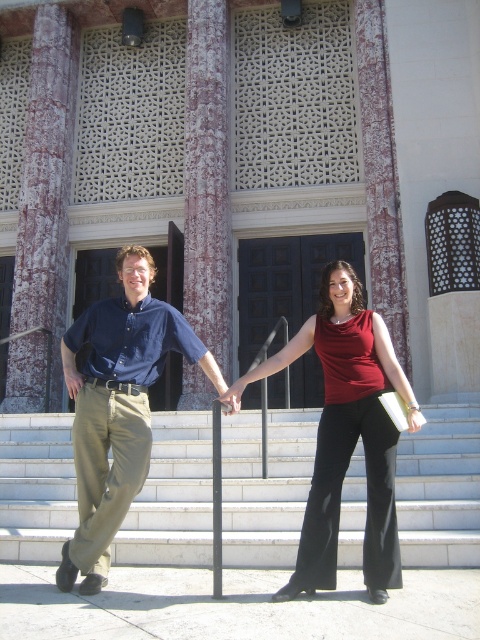
Can you confirm if matte red blouse at center is positioned to the right of matte blue shirt at center?

Indeed, matte red blouse at center is positioned on the right side of matte blue shirt at center.

Does matte red blouse at center have a smaller size compared to matte blue shirt at center?

Incorrect, matte red blouse at center is not smaller in size than matte blue shirt at center.

Which is in front, point (369, 499) or point (171, 324)?

Point (369, 499) is in front.

This screenshot has width=480, height=640. Identify the location of matte red blouse at center. (347, 433).

Between matte blue shirt at center and metallic pole at center, which one has less height?

With less height is matte blue shirt at center.

Is matte blue shirt at center positioned at the back of metallic pole at center?

That is True.

Between point (107, 525) and point (217, 476), which one is positioned behind?

Positioned behind is point (107, 525).

Identify the location of matte blue shirt at center. Image resolution: width=480 pixels, height=640 pixels. (118, 406).

Is white concrete stairs at center bigger than matte blue shirt at left?

Actually, white concrete stairs at center might be smaller than matte blue shirt at left.

Does white concrete stairs at center appear under matte blue shirt at left?

Correct, white concrete stairs at center is located below matte blue shirt at left.

Where is `white concrete stairs at center`? This screenshot has height=640, width=480. white concrete stairs at center is located at coordinates pyautogui.click(x=265, y=486).

You are a GUI agent. You are given a task and a screenshot of the screen. Output one action in this format:
    pyautogui.click(x=<x>, y=<y>)
    Task: Click on the white concrete stairs at center
    
    Given the screenshot: What is the action you would take?
    pyautogui.click(x=265, y=486)